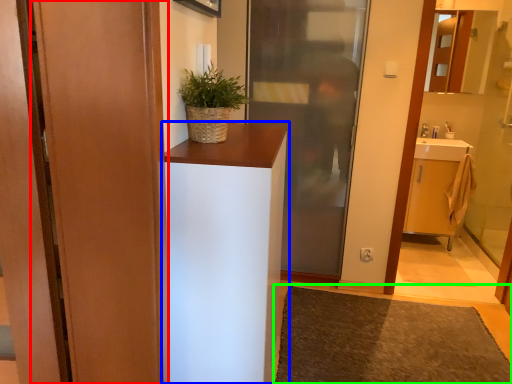
Question: Which object is the closest to the door (highlighted by a red box)? Choose among these: cabinetry (highlighted by a blue box) or doormat (highlighted by a green box).

Choices:
 (A) cabinetry
 (B) doormat

Answer: (A)